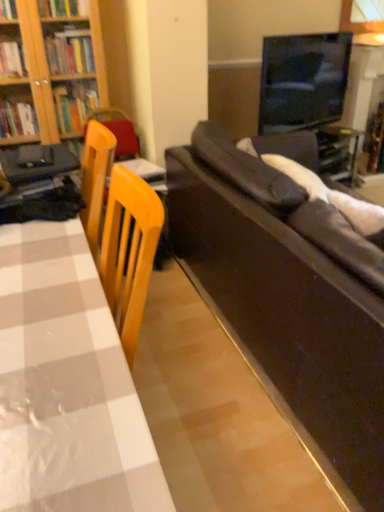
I want to click on white checkered table at left, so click(x=67, y=384).

The height and width of the screenshot is (512, 384). What do you see at coordinates (67, 384) in the screenshot?
I see `white checkered table at left` at bounding box center [67, 384].

The image size is (384, 512). I want to click on leather couch at right, so click(x=289, y=304).

What is the approximate width of leather couch at right?

leather couch at right is 1.02 meters wide.

The width and height of the screenshot is (384, 512). Describe the element at coordinates (289, 304) in the screenshot. I see `leather couch at right` at that location.

At what (x,y) coordinates should I click in order to perform the action: click on white checkered table at left. Please return your answer as a coordinate pair (x, y). The width and height of the screenshot is (384, 512). Looking at the image, I should click on (67, 384).

Between white checkered table at left and leather couch at right, which one appears on the right side from the viewer's perspective?

From the viewer's perspective, leather couch at right appears more on the right side.

Which object is further away from the camera taking this photo, white checkered table at left or leather couch at right?

leather couch at right is more distant.

Is point (57, 382) positioned after point (277, 264)?

No, it is not.

From the image's perspective, is white checkered table at left above or below leather couch at right?

white checkered table at left is below leather couch at right.

From a real-world perspective, which object rests below the other?

leather couch at right, from a real-world perspective.

Which of these two, white checkered table at left or leather couch at right, is thinner?

white checkered table at left is thinner.

From their relative heights in the image, would you say white checkered table at left is taller or shorter than leather couch at right?

Clearly, white checkered table at left is taller compared to leather couch at right.

Can you confirm if white checkered table at left is bigger than leather couch at right?

Incorrect, white checkered table at left is not larger than leather couch at right.

Is white checkered table at left not inside leather couch at right?

Indeed, white checkered table at left is completely outside leather couch at right.

Are white checkered table at left and leather couch at right beside each other?

white checkered table at left and leather couch at right are clearly separated.

Is white checkered table at left looking in the opposite direction of leather couch at right?

Yes, leather couch at right is at the back of white checkered table at left.

How many degrees apart are the facing directions of white checkered table at left and leather couch at right?

179 degrees.

How much distance is there between white checkered table at left and leather couch at right?

They are 29.21 inches apart.

You are a GUI agent. You are given a task and a screenshot of the screen. Output one action in this format:
    pyautogui.click(x=<x>, y=<y>)
    Task: Click on the studio couch located on the right of white checkered table at left
    Image resolution: width=384 pixels, height=512 pixels.
    Given the screenshot: What is the action you would take?
    pyautogui.click(x=289, y=304)

Consider the image. Considering the positions of objects leather couch at right and white checkered table at left in the image provided, who is more to the right, leather couch at right or white checkered table at left?

From the viewer's perspective, leather couch at right appears more on the right side.

Does leather couch at right lie behind white checkered table at left?

Yes, the depth of leather couch at right is greater than that of white checkered table at left.

Is point (181, 194) positioned after point (10, 492)?

Yes, it is.

From the image's perspective, does leather couch at right appear lower than white checkered table at left?

No, from the image's perspective, leather couch at right is not beneath white checkered table at left.

From a real-world perspective, is leather couch at right physically above white checkered table at left?

No, from a real-world perspective, leather couch at right is not above white checkered table at left.

Consider the image. Considering the relative sizes of leather couch at right and white checkered table at left in the image provided, is leather couch at right thinner than white checkered table at left?

No, leather couch at right is not thinner than white checkered table at left.

Considering the sizes of leather couch at right and white checkered table at left in the image, is leather couch at right taller or shorter than white checkered table at left?

Considering their sizes, leather couch at right has less height than white checkered table at left.

Which of these two, leather couch at right or white checkered table at left, is smaller?

white checkered table at left.

Is white checkered table at left inside leather couch at right?

No, white checkered table at left is located outside of leather couch at right.

Is leather couch at right touching white checkered table at left?

No, leather couch at right is not touching white checkered table at left.

Is leather couch at right oriented towards white checkered table at left?

No, leather couch at right is not aimed at white checkered table at left.

How many degrees apart are the facing directions of leather couch at right and white checkered table at left?

There is a 179-degree angle between the facing directions of leather couch at right and white checkered table at left.

You are a GUI agent. You are given a task and a screenshot of the screen. Output one action in this format:
    pyautogui.click(x=<x>, y=<y>)
    Task: Click on the studio couch above the white checkered table at left (from the image's perspective)
    
    Given the screenshot: What is the action you would take?
    pyautogui.click(x=289, y=304)

This screenshot has height=512, width=384. I want to click on table located on the left of leather couch at right, so click(x=67, y=384).

Locate an element on the screen. table below the leather couch at right (from the image's perspective) is located at coordinates (67, 384).